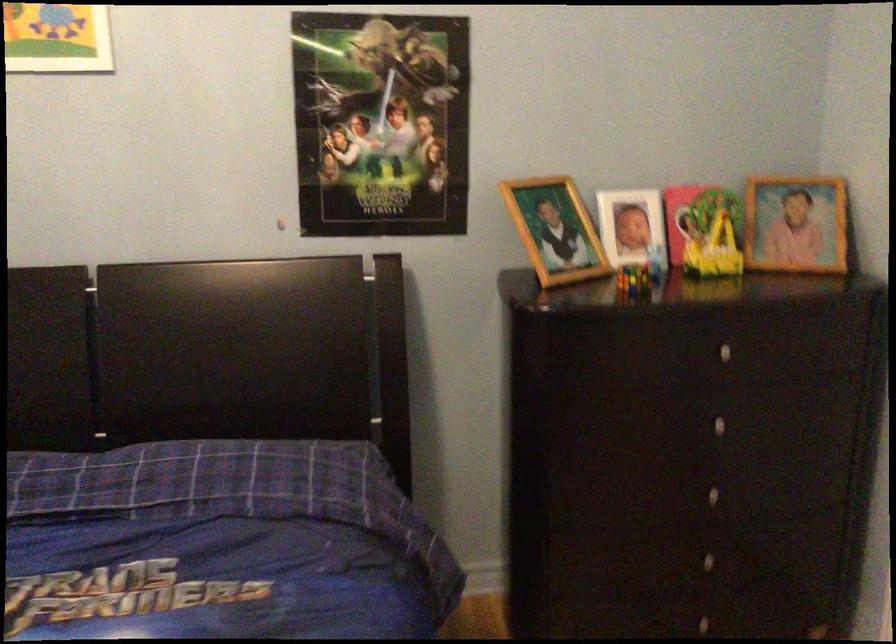
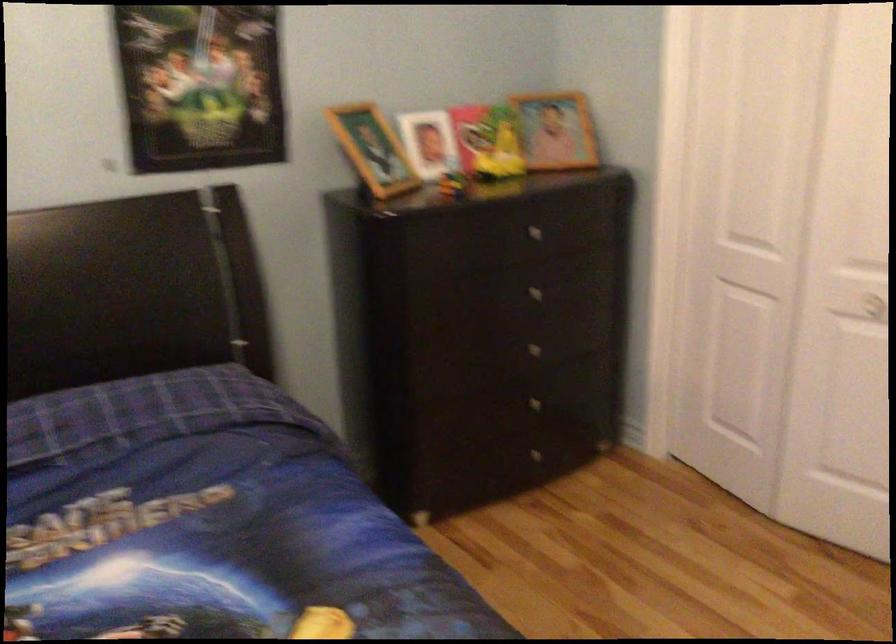
Find the pixel in the second image that matches the point at 800,227 in the first image.

(556, 129)